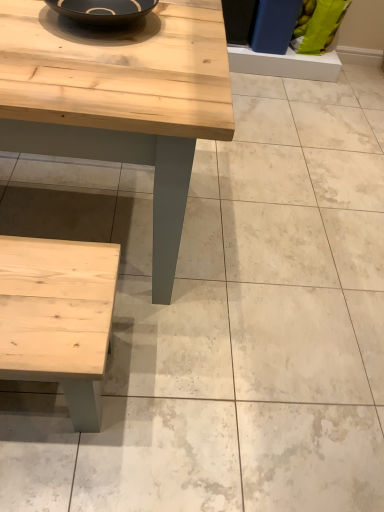
Describe the element at coordinates (120, 99) in the screenshot. This screenshot has width=384, height=512. I see `natural wood coffee table at center` at that location.

Identify the location of natural wood coffee table at center. This screenshot has width=384, height=512. (120, 99).

Find the location of a particular element. natural wood coffee table at center is located at coordinates (120, 99).